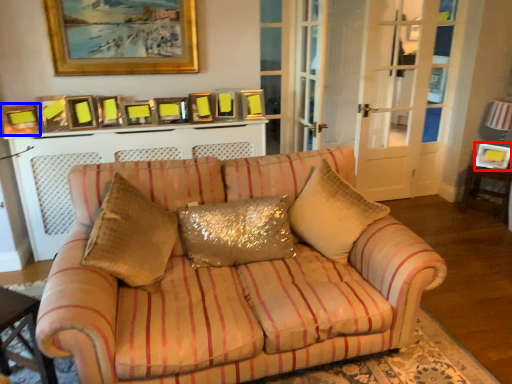
Question: Among these objects, which one is farthest to the camera, picture frame (highlighted by a red box) or picture frame (highlighted by a blue box)?

Choices:
 (A) picture frame
 (B) picture frame

Answer: (A)